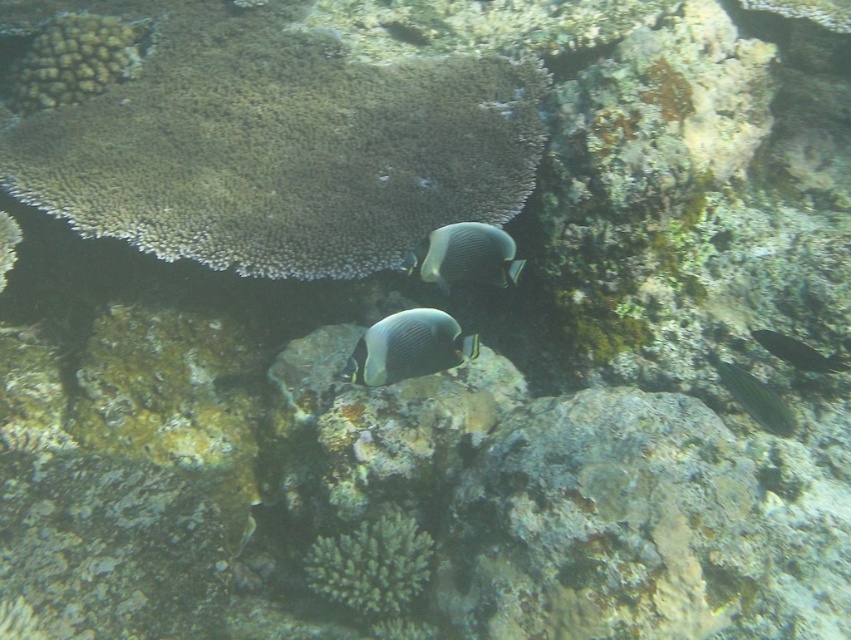
You are a scuba diver who wants to take a photo of two points in the underwater scene. The first point is at coordinates point [369,380] and the second point is at point [467,237]. Which point is closer to you?

Point [369,380] is closer to the viewer than point [467,237].

You are a scuba diver who wants to take a photo of the silvery iridescent fish at center without the brown textured coral at upper center blocking the view. Is the fish currently visible behind the coral?

The brown textured coral at upper center is positioned over the silvery iridescent fish at center, so the fish is currently blocked by the coral and not fully visible.